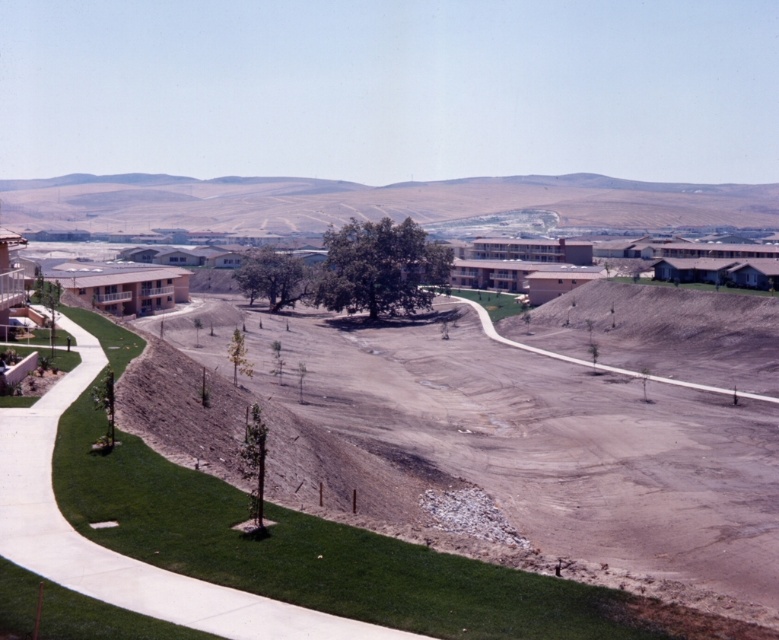
Who is positioned more to the right, dull brown dirt field at center or green concrete sidewalk at center?

dull brown dirt field at center

Where is `dull brown dirt field at center`? dull brown dirt field at center is located at coordinates (529, 456).

Image resolution: width=779 pixels, height=640 pixels. What do you see at coordinates (529, 456) in the screenshot? I see `dull brown dirt field at center` at bounding box center [529, 456].

Which is more to the left, dull brown dirt field at center or dirt/gravel path at center?

dull brown dirt field at center is more to the left.

Does point (333, 406) come in front of point (501, 340)?

Yes, point (333, 406) is in front of point (501, 340).

Identify the location of dull brown dirt field at center. 529,456.

Is green concrete sidewalk at center bigger than dirt/gravel path at center?

No.

Identify the location of green concrete sidewalk at center. (118, 552).

Which is in front, point (321, 620) or point (566, 355)?

Point (321, 620) is in front.

At what (x,y) coordinates should I click in order to perform the action: click on green concrete sidewalk at center. Please return your answer as a coordinate pair (x, y). Looking at the image, I should click on (118, 552).